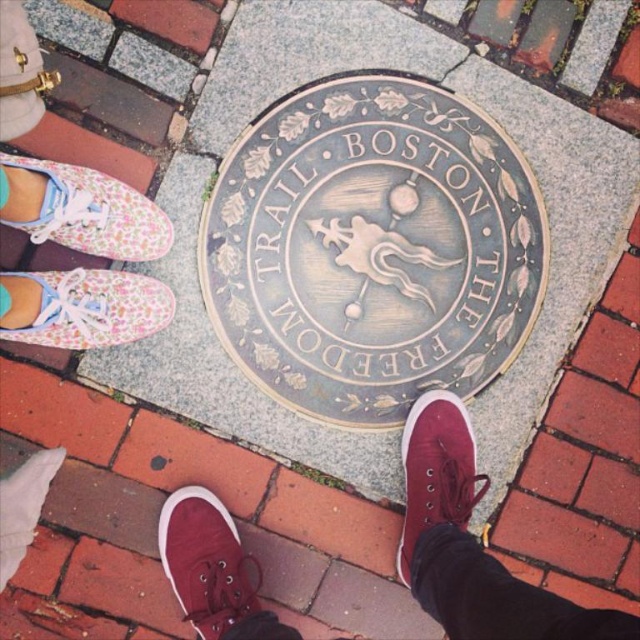
Question: Can you confirm if floral fabric shoe at upper left is positioned above matte canvas sneaker at center?

Choices:
 (A) no
 (B) yes

Answer: (B)

Question: Is matte canvas shoes at center above floral fabric shoe at upper left?

Choices:
 (A) yes
 (B) no

Answer: (B)

Question: Which object is closer to the camera taking this photo?

Choices:
 (A) floral fabric shoe at upper left
 (B) matte canvas shoes at center
 (C) bronze textured medallion at center

Answer: (B)

Question: Which object appears closest to the camera in this image?

Choices:
 (A) floral fabric shoe at lower left
 (B) matte canvas shoes at center

Answer: (B)

Question: Is matte canvas shoes at center below floral fabric shoe at upper left?

Choices:
 (A) yes
 (B) no

Answer: (A)

Question: Considering the real-world distances, which object is farthest from the floral fabric shoe at lower left?

Choices:
 (A) matte canvas sneaker at lower center
 (B) bronze textured medallion at center
 (C) matte canvas shoes at center
 (D) floral fabric shoe at upper left

Answer: (C)